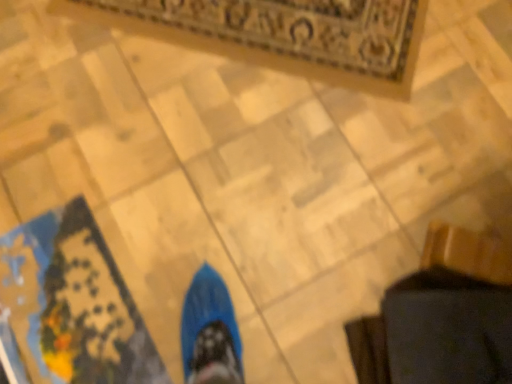
Question: Considering the positions of point (271, 14) and point (84, 314), is point (271, 14) closer or farther from the camera than point (84, 314)?

Choices:
 (A) farther
 (B) closer

Answer: (A)

Question: Do you think carpeted mat at upper center, which appears as the 2th mat when ordered from the bottom, is within blue fabric mat at lower left, acting as the first mat starting from the front, or outside of it?

Choices:
 (A) outside
 (B) inside

Answer: (A)

Question: Is carpeted mat at upper center, which appears as the 2th mat when ordered from the bottom, wider or thinner than blue fabric mat at lower left, placed as the second mat when sorted from top to bottom?

Choices:
 (A) wide
 (B) thin

Answer: (A)

Question: Considering their positions, is blue fabric mat at lower left, placed as the second mat when sorted from top to bottom, located in front of or behind carpeted mat at upper center, the 1th mat viewed from the top?

Choices:
 (A) behind
 (B) front

Answer: (B)

Question: Visually, is blue fabric mat at lower left, placed as the second mat when sorted from back to front, positioned to the left or to the right of carpeted mat at upper center, which is the first mat from back to front?

Choices:
 (A) left
 (B) right

Answer: (A)

Question: Is blue fabric mat at lower left, acting as the first mat starting from the front, wider or thinner than carpeted mat at upper center, which appears as the 2th mat when ordered from the bottom?

Choices:
 (A) thin
 (B) wide

Answer: (A)

Question: From the image's perspective, is blue fabric mat at lower left, placed as the second mat when sorted from back to front, above or below carpeted mat at upper center, which is the first mat from back to front?

Choices:
 (A) above
 (B) below

Answer: (B)